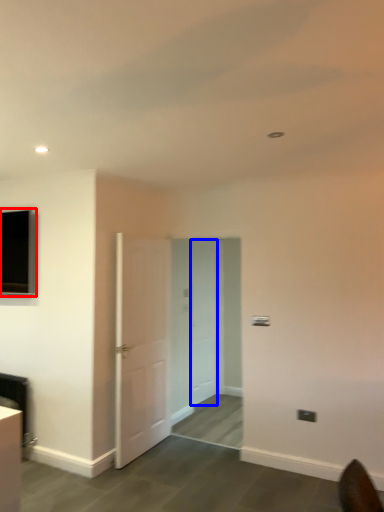
Question: Which object appears farthest to the camera in this image, window (highlighted by a red box) or door (highlighted by a blue box)?

Choices:
 (A) window
 (B) door

Answer: (B)